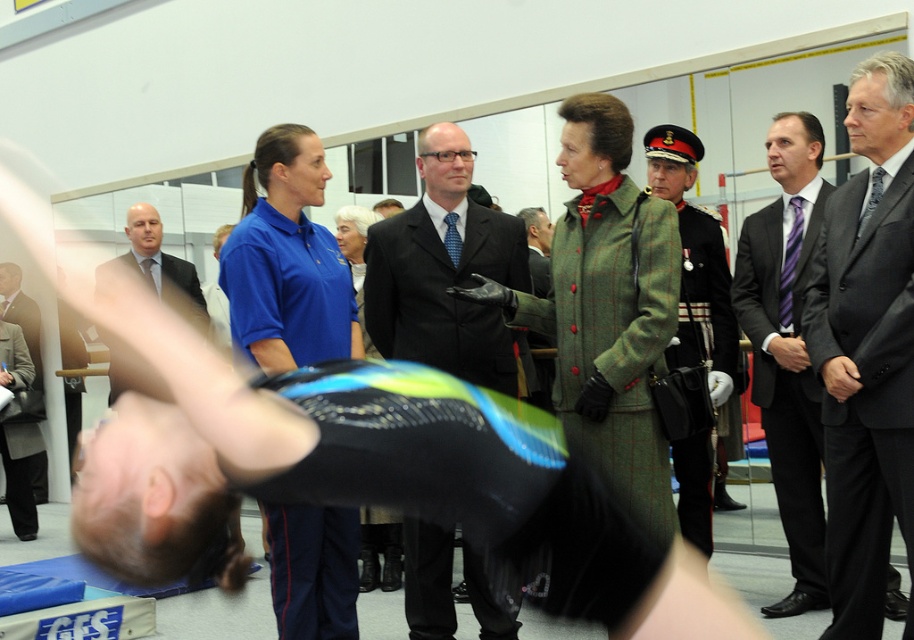
You are a photographer at the event and need to capture a clear shot of both the purple striped tie at center and the matte black suit at left. Based on their positions, which one is closer to the camera?

The purple striped tie at center is located above the matte black suit at left, which means it is closer to the camera.

You are standing at point (806, 445) and want to take a photo of the gymnast on the blue mat. The camera you have can focus up to 15 feet away. Will you be able to capture the gymnast clearly?

The distance between point (806, 445) and the camera is 14.21 feet, which is within the camera focus range of up to 15 feet. Therefore, you can capture the gymnast clearly.